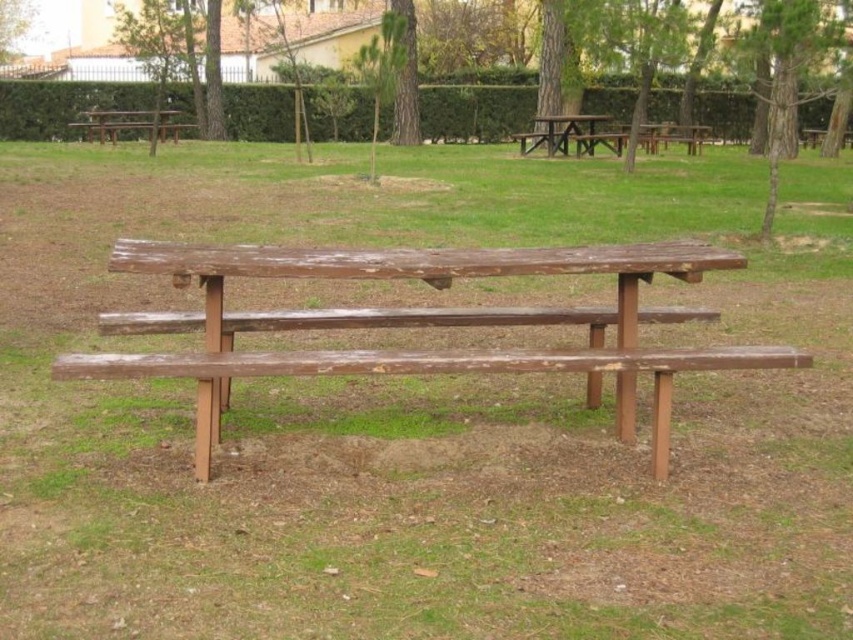
Question: Can you confirm if green rough bark tree at upper center is positioned below green matte tree at center?

Choices:
 (A) yes
 (B) no

Answer: (A)

Question: Is weathered wood bench at center to the left of green matte tree at center from the viewer's perspective?

Choices:
 (A) no
 (B) yes

Answer: (A)

Question: Which point is closer to the camera?

Choices:
 (A) green leafy tree at upper center
 (B) wooden picnic table at center

Answer: (B)

Question: Among these objects, which one is farthest from the camera?

Choices:
 (A) green matte tree at center
 (B) wooden picnic table at center

Answer: (B)

Question: Which of the following is the closest to the observer?

Choices:
 (A) (410, 83)
 (B) (402, 51)
 (C) (791, 77)
 (D) (526, 150)

Answer: (C)

Question: Can you confirm if green textured tree at upper center is thinner than wooden picnic table at center?

Choices:
 (A) no
 (B) yes

Answer: (A)